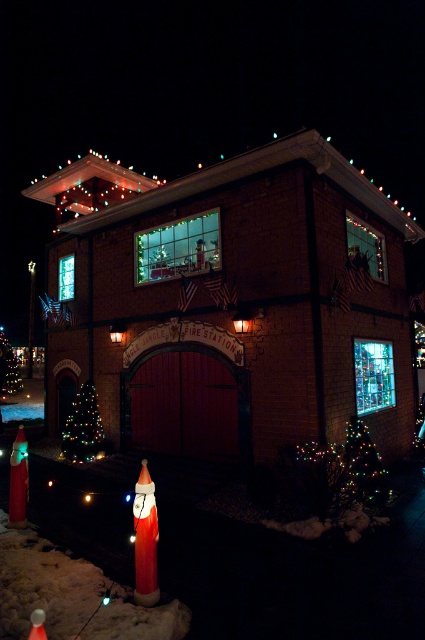
You are a visitor standing in front of the fire station. You notice the multicolored lights at lower right and the green matte christmas tree at lower left. Which object is positioned closer to you?

The multicolored lights at lower right is closer to the viewer than the green matte christmas tree at lower left.

You are standing in front of the fire station and see two points marked on the building. The first point is at coordinates point [172,385] and the second is at point [371,493]. Which point is closer to you?

Point [172,385] is closer to you because it is further to the camera than point [371,493].

You are standing in front of the fire station and notice the multicolored lights at lower right and the green matte christmas tree at lower left. Which object is positioned lower in the scene?

The multicolored lights at lower right is below green matte christmas tree at lower left, so the multicolored lights at lower right is positioned lower in the scene.